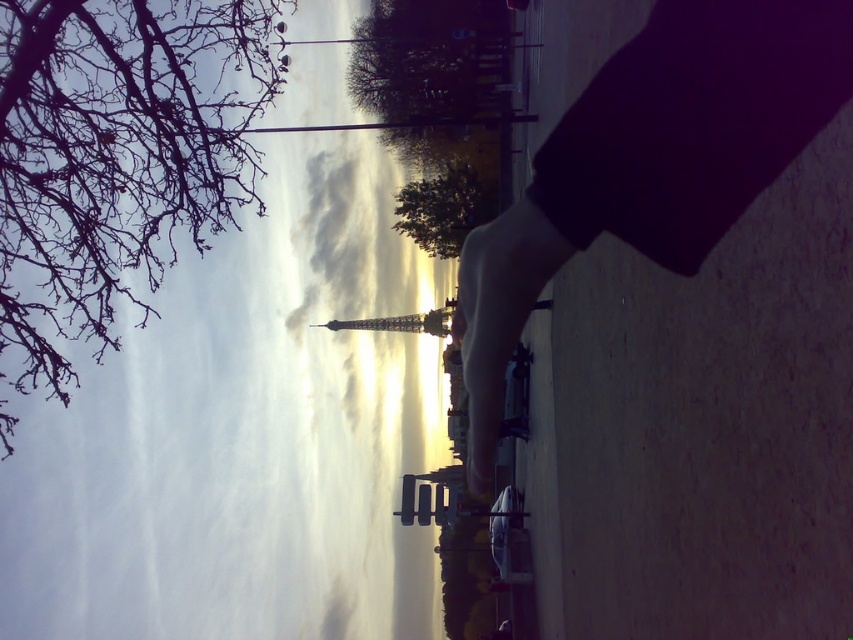
You are a photographer standing at the center of the plaza. You want to take a photo of the Eiffel Tower with the smooth black skateboard at center in the foreground. However, the bare branches at upper left are blocking your view. Can you move the skateboard forward to avoid the branches?

The smooth black skateboard at center is behind the bare branches at upper left. Moving the skateboard forward would place it closer to the photographer, potentially moving it out from behind the branches, allowing the Eiffel Tower to be visible without obstruction.

You are a tourist standing in the plaza in front of the Eiffel Tower. You notice two trees in the scene. Which tree is closer to the left side of the image, the bare branches at upper left or the green leafy tree at center?

The bare branches at upper left is to the left of green leafy tree at center, so the bare branches at upper left is closer to the left side of the image.